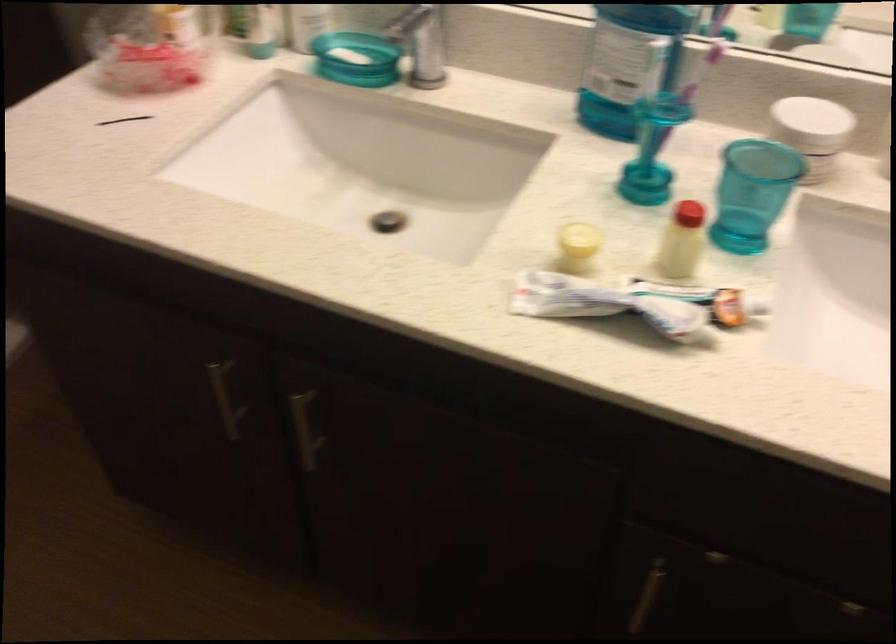
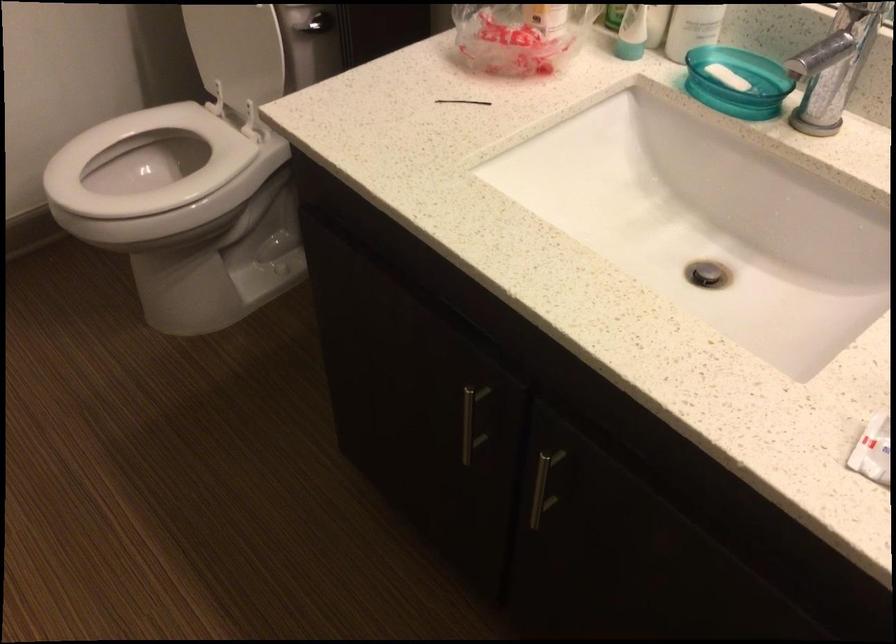
Locate, in the second image, the point that corresponds to the point at 388,222 in the first image.

(707, 274)